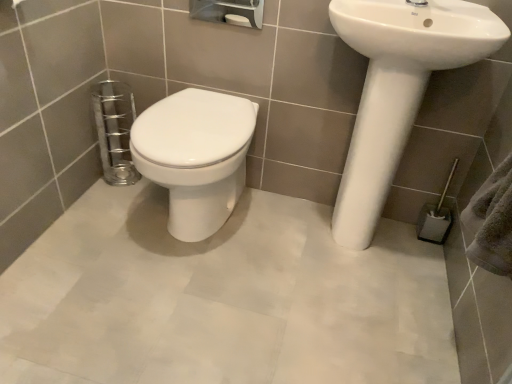
Question: Considering the positions of white glossy bidet at center and white glossy sink at upper right in the image, is white glossy bidet at center wider or thinner than white glossy sink at upper right?

Choices:
 (A) wide
 (B) thin

Answer: (A)

Question: From their relative heights in the image, would you say white glossy bidet at center is taller or shorter than white glossy sink at upper right?

Choices:
 (A) tall
 (B) short

Answer: (A)

Question: Estimate the real-world distances between objects in this image. Which object is farther from the gray fabric towel bar at lower right?

Choices:
 (A) white glossy sink at upper right
 (B) white glossy sink at right
 (C) white glossy bidet at center

Answer: (C)

Question: Estimate the real-world distances between objects in this image. Which object is farther from the white glossy sink at upper right?

Choices:
 (A) white glossy sink at right
 (B) gray fabric towel bar at lower right
 (C) white glossy bidet at center

Answer: (C)